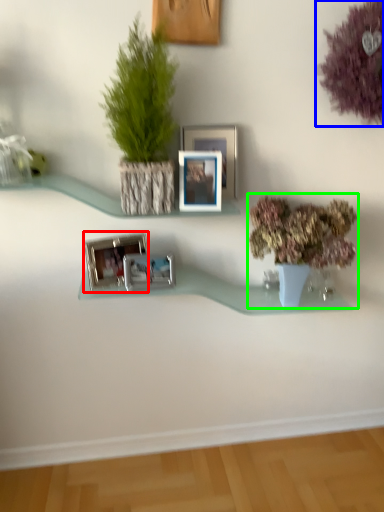
Question: Which is farther away from picture frame (highlighted by a red box)? flower (highlighted by a blue box) or houseplant (highlighted by a green box)?

Choices:
 (A) flower
 (B) houseplant

Answer: (A)